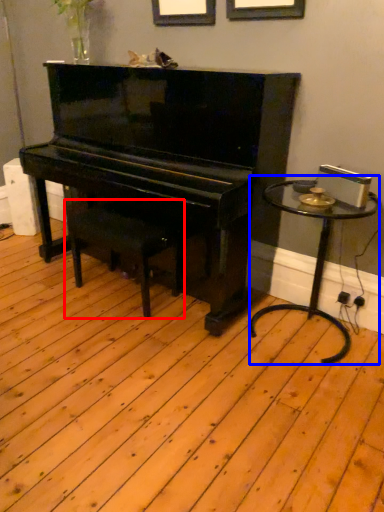
Question: Which point is closer to the camera, music stool (highlighted by a red box) or table (highlighted by a blue box)?

Choices:
 (A) music stool
 (B) table

Answer: (B)